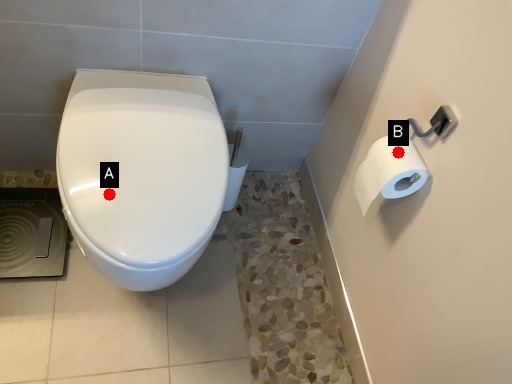
Question: Two points are circled on the image, labeled by A and B beside each circle. Which point appears farthest from the camera in this image?

Choices:
 (A) A is further
 (B) B is further

Answer: (B)